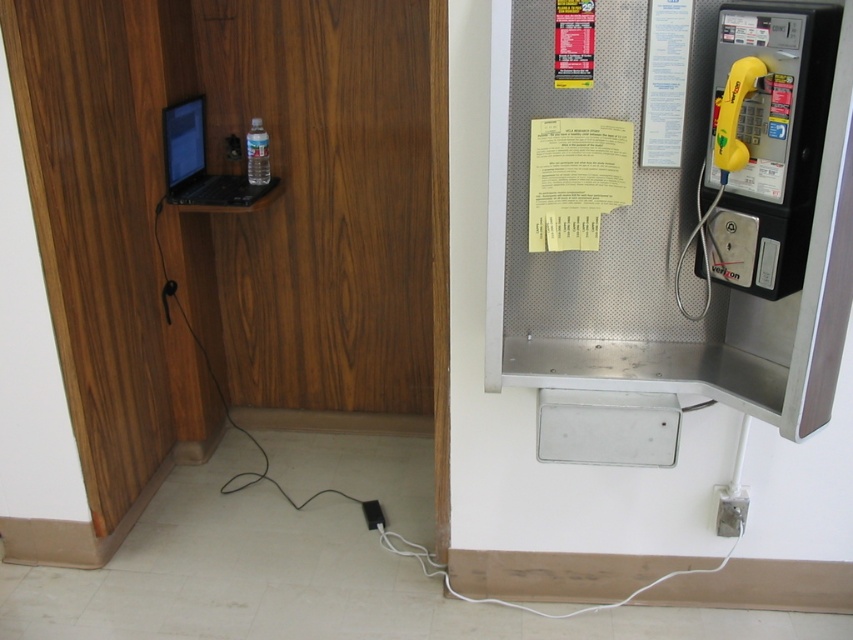
Question: Which of the following is the closest to the observer?

Choices:
 (A) matte black laptop at upper left
 (B) yellow plastic payphone at right
 (C) black plastic plug at lower center

Answer: (B)

Question: Can you confirm if matte black laptop at upper left is smaller than black plastic plug at lower center?

Choices:
 (A) yes
 (B) no

Answer: (B)

Question: In this image, where is yellow plastic payphone at right located relative to matte black laptop at upper left?

Choices:
 (A) right
 (B) left

Answer: (A)

Question: Which object appears closest to the camera in this image?

Choices:
 (A) matte black laptop at upper left
 (B) yellow plastic payphone at right

Answer: (B)

Question: Can you confirm if yellow plastic payphone at right is thinner than matte black laptop at upper left?

Choices:
 (A) no
 (B) yes

Answer: (B)

Question: Among these objects, which one is nearest to the camera?

Choices:
 (A) black plastic plug at lower center
 (B) yellow plastic payphone at right
 (C) matte black laptop at upper left

Answer: (B)